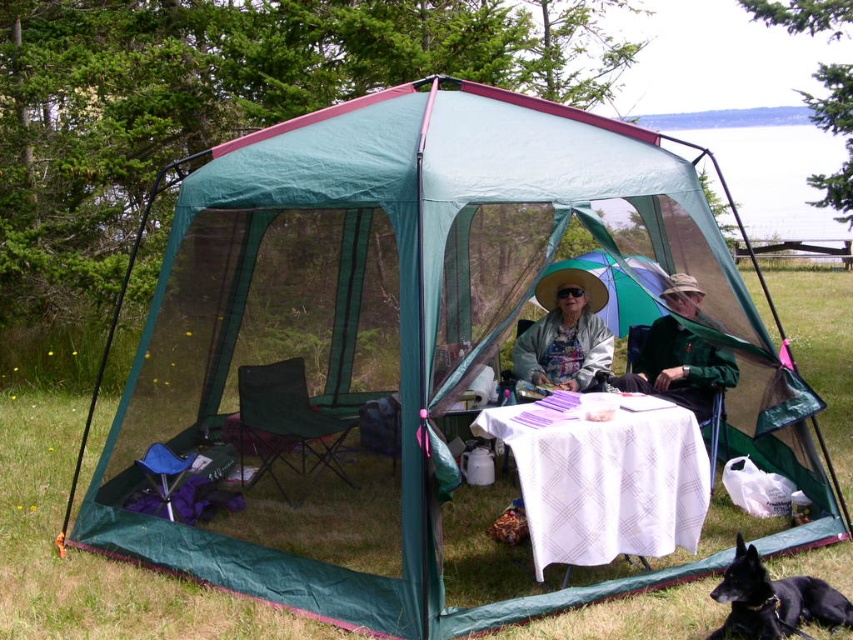
You are planning to place a new decorative item on the white cloth table at center. Considering the size of the matte green hat at center currently on the table, will the table have enough space for the new item without overlapping?

The white cloth table at center has a larger width than the matte green hat at center, so there should be enough space to place the new item without overlapping.